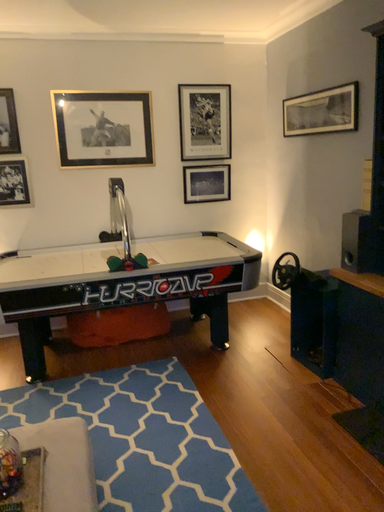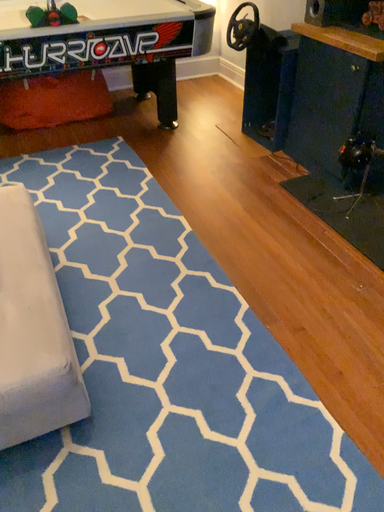
Question: How did the camera likely rotate when shooting the video?

Choices:
 (A) rotated downward
 (B) rotated upward

Answer: (A)